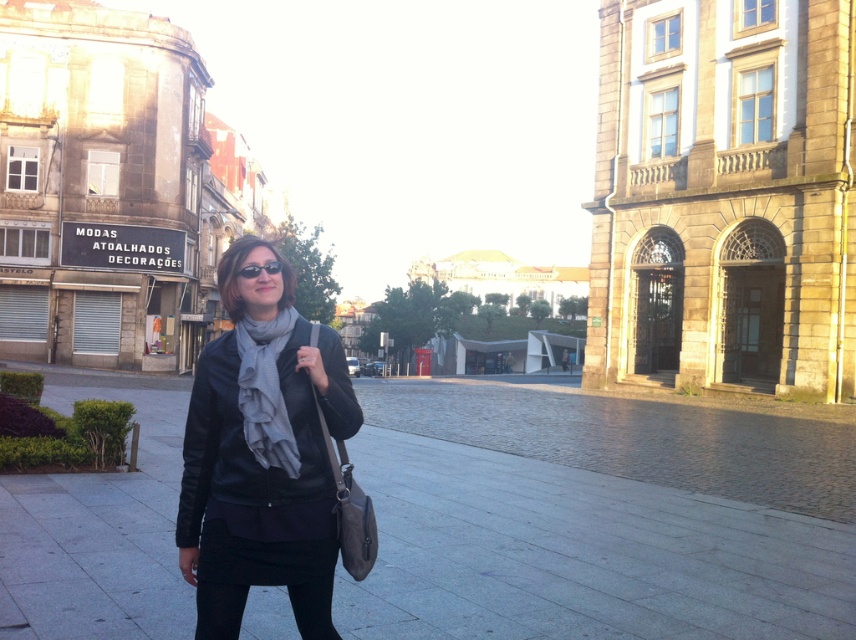
You are a fashion designer observing the urban scene. You notice the black leather skirt at lower center and the black matte sunglasses at center. Which item appears taller in the image?

The black leather skirt at lower center is much taller than the black matte sunglasses at center in the image.

You are a photographer who wants to capture a closeup shot of the matte black jacket at center and the gray soft scarf at center. Which object should you focus on first if you want to ensure both are in focus without changing the camera position?

The matte black jacket at center is to the left of gray soft scarf at center. Since they are positioned side by side, focusing on the matte black jacket at center first will help ensure both are in focus as they are close in proximity.

You are a fashion designer analyzing the image. You need to determine if the black leather skirt at lower center can be paired with the black matte sunglasses at center based on their sizes. Can the skirt accommodate the sunglasses in its pocket?

The black leather skirt at lower center has a larger width than the black matte sunglasses at center, so the skirt can accommodate the sunglasses in its pocket.